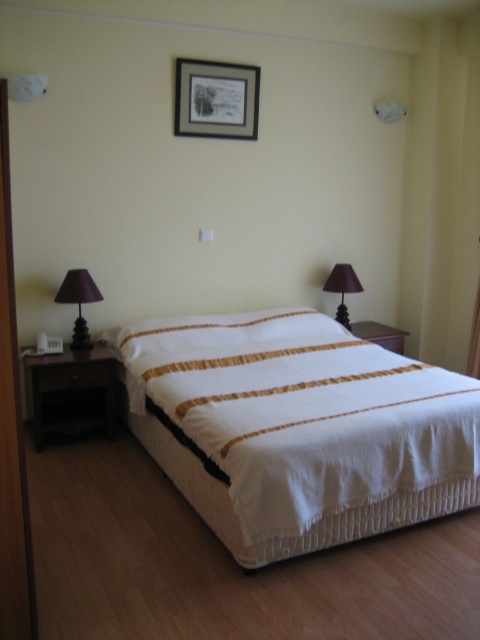
Question: Does matte purple fabric lampshade at left have a smaller size compared to matte brown lampshade at upper right?

Choices:
 (A) yes
 (B) no

Answer: (A)

Question: Based on their relative distances, which object is farther from the matte purple fabric lampshade at left?

Choices:
 (A) black wood picture frame at upper center
 (B) white textured bed at center

Answer: (A)

Question: Among these objects, which one is farthest from the camera?

Choices:
 (A) black wood picture frame at upper center
 (B) matte purple fabric lampshade at left
 (C) white textured bed at center

Answer: (A)

Question: Is white textured bed at center positioned before matte brown lampshade at upper right?

Choices:
 (A) yes
 (B) no

Answer: (A)

Question: Which is farther from the matte purple fabric lampshade at left?

Choices:
 (A) white textured bed at center
 (B) matte brown lampshade at upper right
 (C) black wood picture frame at upper center

Answer: (B)

Question: From the image, what is the correct spatial relationship of white textured bed at center in relation to matte purple fabric lampshade at left?

Choices:
 (A) below
 (B) above

Answer: (A)